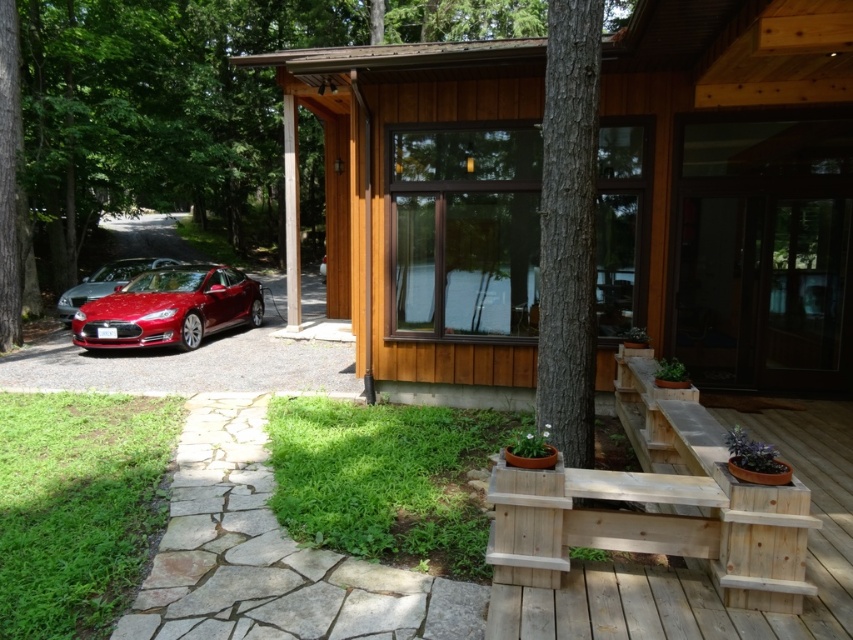
Question: Can you confirm if shiny metallic red sports car at left is smaller than shiny red car at left?

Choices:
 (A) no
 (B) yes

Answer: (A)

Question: Which object is the farthest from the light brown wooden bench at lower center?

Choices:
 (A) shiny red car at left
 (B) wooden cabin at center
 (C) shiny metallic red sports car at left

Answer: (A)

Question: Is light brown wooden bench at lower center bigger than shiny red car at left?

Choices:
 (A) yes
 (B) no

Answer: (B)

Question: Among these objects, which one is farthest from the camera?

Choices:
 (A) light brown wooden bench at lower center
 (B) wooden cabin at center

Answer: (B)

Question: Which object is the farthest from the light brown wooden bench at lower center?

Choices:
 (A) shiny metallic red sports car at left
 (B) shiny red car at left
 (C) wooden cabin at center

Answer: (B)

Question: Does light brown wooden bench at lower center appear on the right side of shiny metallic red sports car at left?

Choices:
 (A) no
 (B) yes

Answer: (B)